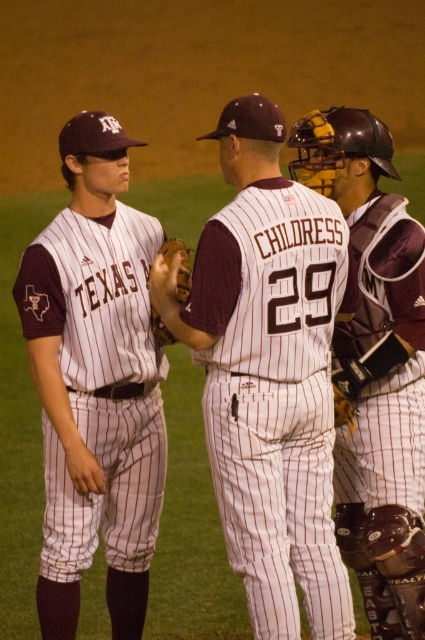
Consider the image. Does white pinstriped jersey at center lie behind white pinstriped uniform at center?

No.

Does white pinstriped jersey at center appear under white pinstriped uniform at center?

Yes, white pinstriped jersey at center is below white pinstriped uniform at center.

Is point (343, 256) less distant than point (104, 396)?

That is True.

Locate an element on the screen. The width and height of the screenshot is (425, 640). white pinstriped jersey at center is located at coordinates (274, 397).

Is maroon leather catcher's gear at right closer to camera compared to brown leather glove at center?

Yes, maroon leather catcher's gear at right is in front of brown leather glove at center.

Which of these two, maroon leather catcher's gear at right or brown leather glove at center, stands shorter?

brown leather glove at center

Does point (339, 326) lie behind point (153, 324)?

That is True.

Identify the location of maroon leather catcher's gear at right. (384, 416).

Between white pinstriped uniform at center and brown leather glove at center, which one has less height?

brown leather glove at center

Which is behind, point (112, 332) or point (183, 248)?

The point (183, 248) is more distant.

Locate an element on the screen. This screenshot has height=640, width=425. white pinstriped uniform at center is located at coordinates tap(96, 381).